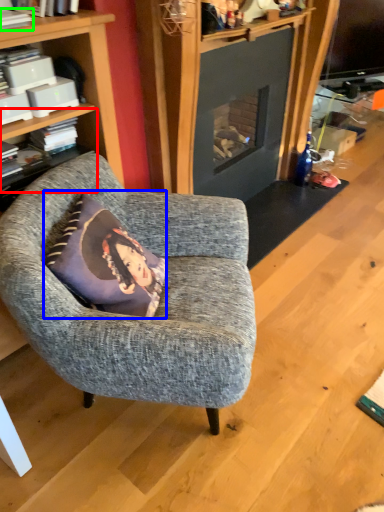
Question: Based on their relative distances, which object is nearer to shelf (highlighted by a red box)? Choose from pillow (highlighted by a blue box) and book (highlighted by a green box).

Choices:
 (A) pillow
 (B) book

Answer: (B)